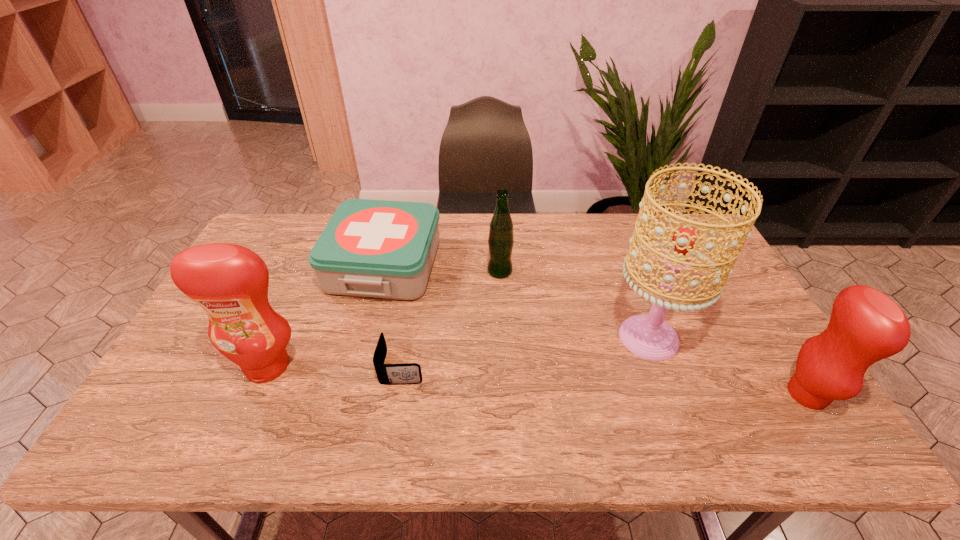
This screenshot has height=540, width=960. What are the coordinates of `blank space located on the front of the beer bottle` in the screenshot? It's located at (501, 293).

Where is `vacant space located 0.220m on the front of the second shortest object`? vacant space located 0.220m on the front of the second shortest object is located at coordinates (358, 368).

Identify the location of vacant space positioned 0.270m on the outer surface of the wallet. (530, 367).

Locate an element on the screen. This screenshot has width=960, height=540. object that is at the far edge is located at coordinates (370, 248).

The height and width of the screenshot is (540, 960). I want to click on wallet at the near edge, so click(x=388, y=374).

The image size is (960, 540). What are the coordinates of `object positioned at the left edge` in the screenshot? It's located at (230, 282).

Where is `object at the right edge`? object at the right edge is located at coordinates (866, 326).

Locate an element on the screen. object that is at the near left corner is located at coordinates (230, 282).

Identify the location of object located at the near right corner. This screenshot has width=960, height=540. (866, 326).

You are a GUI agent. You are given a task and a screenshot of the screen. Output one action in this format:
    pyautogui.click(x=<x>, y=<y>)
    Task: Click on the vacant area at the far edge of the desktop
    
    Given the screenshot: What is the action you would take?
    pyautogui.click(x=540, y=219)